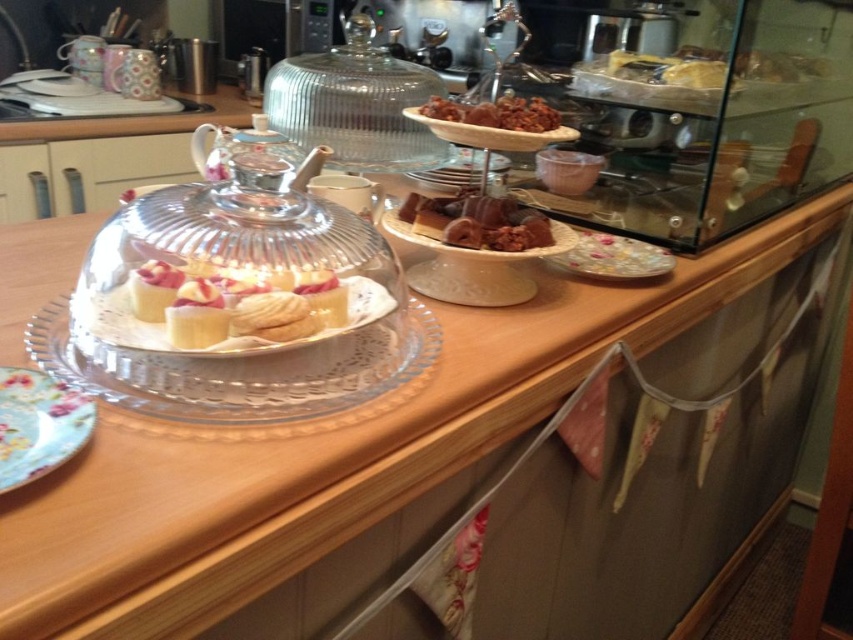
Can you confirm if floral paper plate at lower left is shorter than chocolate-coated nuts at center?

Incorrect, floral paper plate at lower left's height does not fall short of chocolate-coated nuts at center's.

Locate an element on the screen. This screenshot has width=853, height=640. floral paper plate at lower left is located at coordinates click(38, 424).

Is point (48, 458) positioned behind point (456, 118)?

No, it is in front of (456, 118).

This screenshot has height=640, width=853. I want to click on floral paper plate at lower left, so click(x=38, y=424).

Is the position of white porcelain plate at center more distant than that of white crumbly cookie at center?

No.

Between white porcelain plate at center and white crumbly cookie at center, which one is positioned higher?

Positioned higher is white porcelain plate at center.

Find the location of a particular element. This screenshot has width=853, height=640. white porcelain plate at center is located at coordinates (230, 337).

Is chocolate glossy cake at center positioned before shiny brown chocolate at center?

No.

You are a GUI agent. You are given a task and a screenshot of the screen. Output one action in this format:
    pyautogui.click(x=<x>, y=<y>)
    Task: Click on the chocolate glossy cake at center
    This screenshot has height=640, width=853.
    Given the screenshot: What is the action you would take?
    pyautogui.click(x=477, y=221)